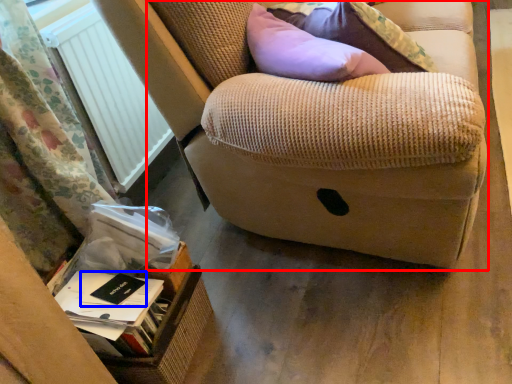
Question: Among these objects, which one is nearest to the camera, furniture (highlighted by a red box) or paperback book (highlighted by a blue box)?

Choices:
 (A) furniture
 (B) paperback book

Answer: (A)